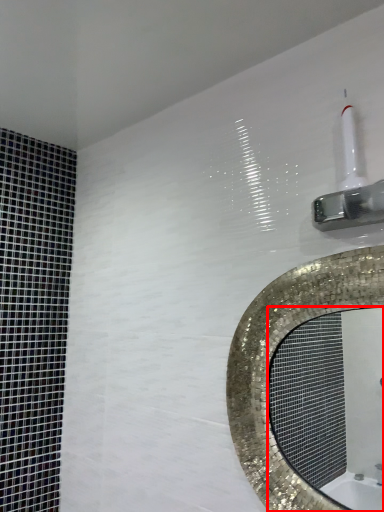
Question: From the image's perspective, what is the correct spatial positioning of mirror (annotated by the red box) in reference to shower?

Choices:
 (A) below
 (B) above

Answer: (A)